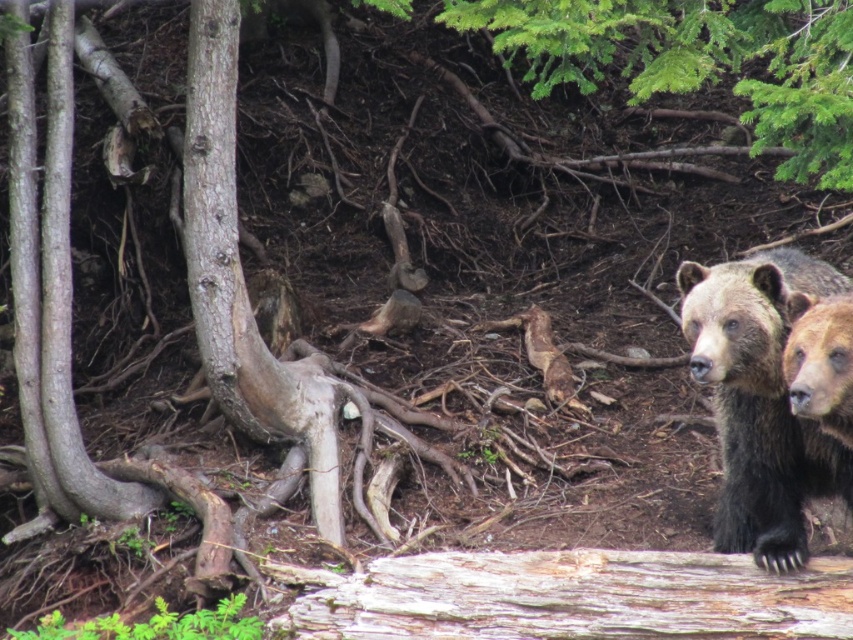
Question: Which point appears closest to the camera in this image?

Choices:
 (A) (828, 608)
 (B) (216, 372)
 (C) (780, 499)

Answer: (A)

Question: Based on their relative distances, which object is nearer to the brown fur bear at right?

Choices:
 (A) smooth brown bark at center
 (B) weathered wood at lower right

Answer: (B)

Question: Which point appears farthest from the camera in this image?

Choices:
 (A) (683, 264)
 (B) (224, 115)
 (C) (845, 634)

Answer: (B)

Question: Does weathered wood at lower right appear on the right side of smooth brown bark at center?

Choices:
 (A) yes
 (B) no

Answer: (A)

Question: Does brown fur bear at right have a larger size compared to smooth brown bark at center?

Choices:
 (A) no
 (B) yes

Answer: (A)

Question: Can you confirm if brown fur bear at right is thinner than smooth brown bark at center?

Choices:
 (A) yes
 (B) no

Answer: (A)